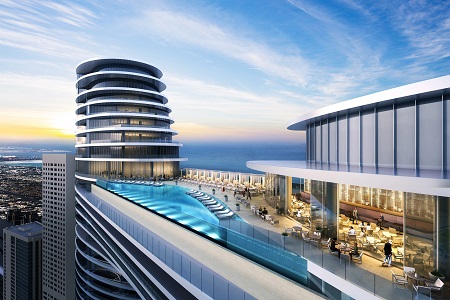
Where is `tables`? The height and width of the screenshot is (300, 450). tables is located at coordinates (296, 235), (344, 249), (417, 279).